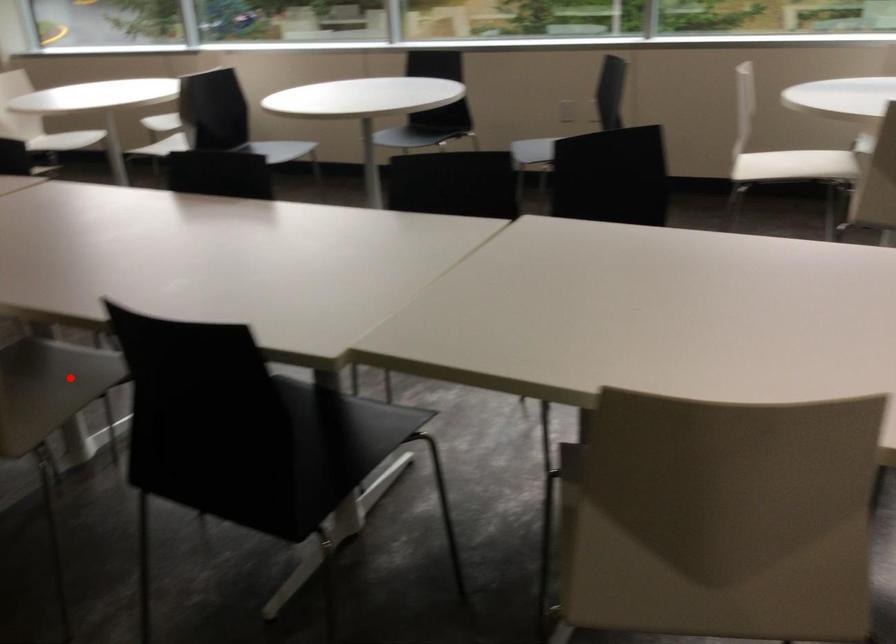
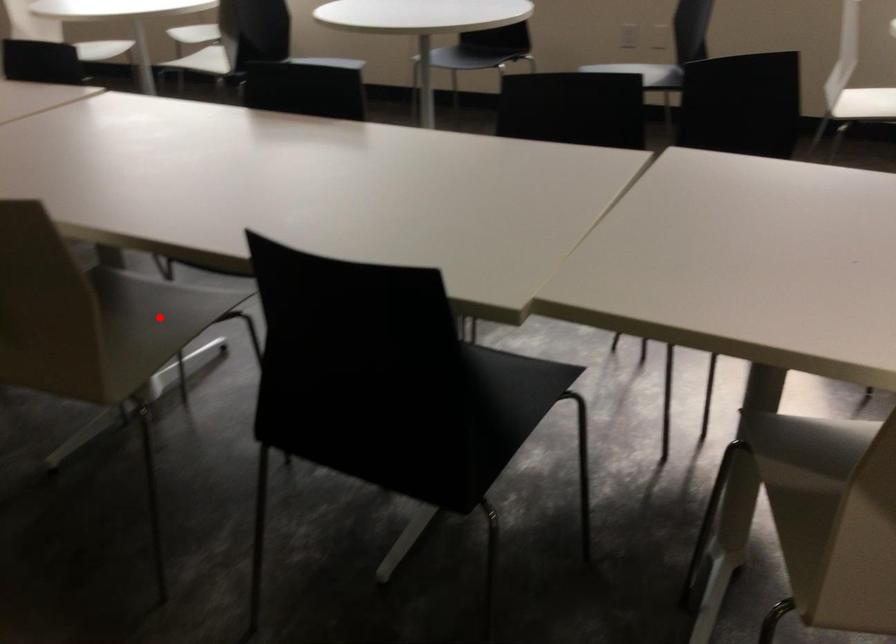
I am providing you with two images of the same scene from different viewpoints. A red point is marked on the first image and another point is marked on the second image. Is the red point in image1 aligned with the point shown in image2?

Yes